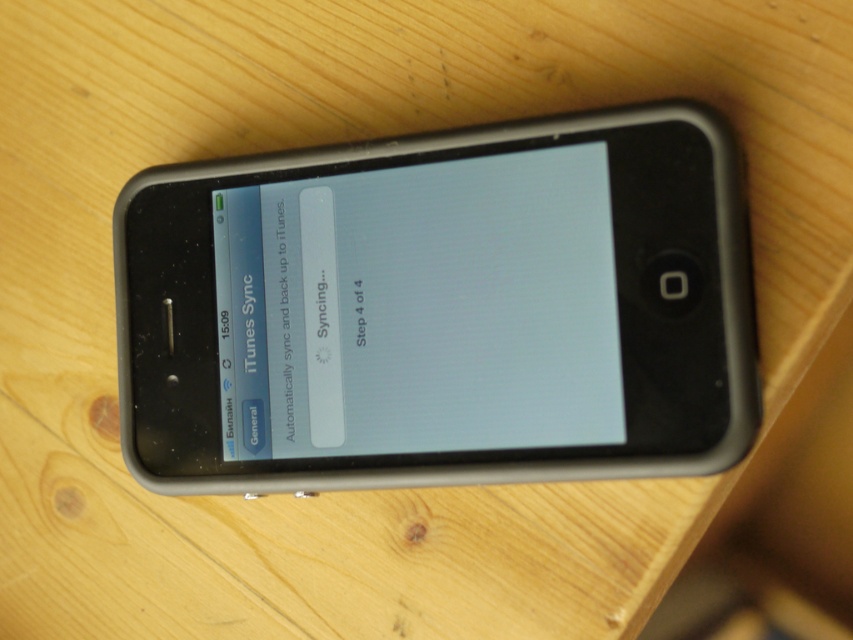
Who is shorter, matte black screen at center or white matte text message at upper left?

white matte text message at upper left

Is the position of matte black screen at center more distant than that of white matte text message at upper left?

That is False.

Between point (424, 193) and point (281, 230), which one is positioned in front?

Point (424, 193) is more forward.

The height and width of the screenshot is (640, 853). I want to click on matte black screen at center, so click(x=422, y=308).